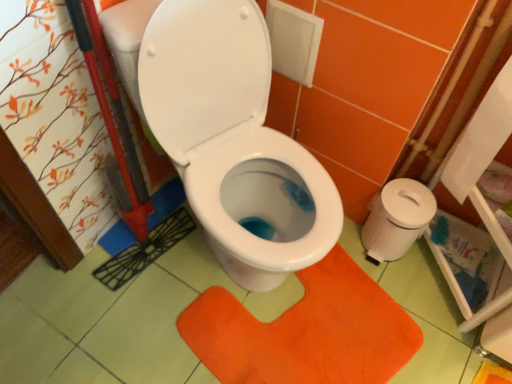
I want to click on white plastic toilet paper at right, positioned as the 1th toilet paper in back-to-front order, so click(397, 219).

Locate an element on the screen. The image size is (512, 384). orange textured mat at center is located at coordinates (306, 331).

Locate an element on the screen. Image resolution: width=512 pixels, height=384 pixels. white plastic toilet paper at right, positioned as the 1th toilet paper in back-to-front order is located at coordinates (397, 219).

Is white plastic toilet paper at right, which is the 2th toilet paper from front to back, far away from white paper at right, which is the second toilet paper from back to front?

No, white plastic toilet paper at right, which is the 2th toilet paper from front to back, is in close proximity to white paper at right, which is the second toilet paper from back to front.

Is white plastic toilet paper at right, which is the 2th toilet paper from front to back, taller or shorter than white paper at right, acting as the 1th toilet paper starting from the front?

Considering their sizes, white plastic toilet paper at right, which is the 2th toilet paper from front to back, has less height than white paper at right, acting as the 1th toilet paper starting from the front.

Considering the points (387, 190) and (510, 107), which point is in front, point (387, 190) or point (510, 107)?

The point (510, 107) is in front.

Between white plastic toilet paper at right, which is the 2th toilet paper from front to back, and white paper at right, acting as the 1th toilet paper starting from the front, which one has smaller size?

Smaller between the two is white paper at right, acting as the 1th toilet paper starting from the front.

Could you measure the distance between white paper at right, acting as the 1th toilet paper starting from the front, and white plastic toilet paper at right, which is the 2th toilet paper from front to back?

white paper at right, acting as the 1th toilet paper starting from the front, is 9.29 inches from white plastic toilet paper at right, which is the 2th toilet paper from front to back.

The image size is (512, 384). Identify the location of toilet paper directly beneath the white paper at right, which is the second toilet paper from back to front (from a real-world perspective). (397, 219).

From the image's perspective, does white paper at right, acting as the 1th toilet paper starting from the front, appear lower than white plastic toilet paper at right, which is the 2th toilet paper from front to back?

Actually, white paper at right, acting as the 1th toilet paper starting from the front, appears above white plastic toilet paper at right, which is the 2th toilet paper from front to back, in the image.

From a real-world perspective, is white paper at right, acting as the 1th toilet paper starting from the front, positioned under white plastic toilet paper at right, positioned as the 1th toilet paper in back-to-front order, based on gravity?

Actually, white paper at right, acting as the 1th toilet paper starting from the front, is physically above white plastic toilet paper at right, positioned as the 1th toilet paper in back-to-front order, in the real world.

Is orange textured mat at center not near white plastic toilet paper at right, which is the 2th toilet paper from front to back?

No, there isn't a large distance between orange textured mat at center and white plastic toilet paper at right, which is the 2th toilet paper from front to back.

Is orange textured mat at center positioned beyond the bounds of white plastic toilet paper at right, which is the 2th toilet paper from front to back?

orange textured mat at center lies outside white plastic toilet paper at right, which is the 2th toilet paper from front to back,'s area.

Consider the image. From a real-world perspective, which is physically above, orange textured mat at center or white plastic toilet paper at right, positioned as the 1th toilet paper in back-to-front order?

In real-world perspective, white plastic toilet paper at right, positioned as the 1th toilet paper in back-to-front order, is above.

Is the position of orange textured mat at center less distant than that of white plastic toilet paper at right, positioned as the 1th toilet paper in back-to-front order?

Yes, it is.

In terms of size, does white paper at right, acting as the 1th toilet paper starting from the front, appear bigger or smaller than orange textured mat at center?

white paper at right, acting as the 1th toilet paper starting from the front, is smaller than orange textured mat at center.

Does white paper at right, acting as the 1th toilet paper starting from the front, have a greater height compared to orange textured mat at center?

Yes.

Does white paper at right, acting as the 1th toilet paper starting from the front, touch orange textured mat at center?

white paper at right, acting as the 1th toilet paper starting from the front, is not next to orange textured mat at center, and they're not touching.

Is white paper at right, which is the second toilet paper from back to front, positioned beyond the bounds of orange textured mat at center?

Yes, white paper at right, which is the second toilet paper from back to front, is not within orange textured mat at center.

Would you say white paper at right, acting as the 1th toilet paper starting from the front, is part of orange textured mat at center's contents?

Actually, white paper at right, acting as the 1th toilet paper starting from the front, is outside orange textured mat at center.

Between point (214, 299) and point (492, 86), which one is positioned in front?

Point (492, 86)

Which of these two, orange textured mat at center or white paper at right, which is the second toilet paper from back to front, is thinner?

white paper at right, which is the second toilet paper from back to front.

From the image's perspective, who appears lower, orange textured mat at center or white paper at right, which is the second toilet paper from back to front?

orange textured mat at center, from the image's perspective.

Is white plastic toilet paper at right, which is the 2th toilet paper from front to back, spatially inside orange textured mat at center, or outside of it?

white plastic toilet paper at right, which is the 2th toilet paper from front to back, lies outside orange textured mat at center.

Which is in front, point (382, 191) or point (298, 277)?

The point (382, 191) is in front.

Is there a large distance between white plastic toilet paper at right, positioned as the 1th toilet paper in back-to-front order, and orange textured mat at center?

They are positioned close to each other.

From a real-world perspective, does white plastic toilet paper at right, positioned as the 1th toilet paper in back-to-front order, sit lower than orange textured mat at center?

Incorrect, from a real-world perspective, white plastic toilet paper at right, positioned as the 1th toilet paper in back-to-front order, is higher than orange textured mat at center.

Where is `toilet paper on the right of white plastic toilet paper at right, which is the 2th toilet paper from front to back`? This screenshot has width=512, height=384. toilet paper on the right of white plastic toilet paper at right, which is the 2th toilet paper from front to back is located at coordinates (480, 137).

In order to click on toilet paper that appears below the white paper at right, acting as the 1th toilet paper starting from the front (from a real-world perspective) in this screenshot , I will do `click(397, 219)`.

Which object lies nearer to the anchor point white plastic toilet paper at right, which is the 2th toilet paper from front to back, orange textured mat at center or white paper at right, which is the second toilet paper from back to front?

white paper at right, which is the second toilet paper from back to front, is closer to white plastic toilet paper at right, which is the 2th toilet paper from front to back.

Consider the image. Looking at the image, which one is located closer to white paper at right, acting as the 1th toilet paper starting from the front, orange textured mat at center or white plastic toilet paper at right, which is the 2th toilet paper from front to back?

white plastic toilet paper at right, which is the 2th toilet paper from front to back.

Estimate the real-world distances between objects in this image. Which object is further from white plastic toilet paper at right, positioned as the 1th toilet paper in back-to-front order, white paper at right, acting as the 1th toilet paper starting from the front, or orange textured mat at center?

orange textured mat at center.

Which object lies nearer to the anchor point orange textured mat at center, white paper at right, which is the second toilet paper from back to front, or white plastic toilet paper at right, which is the 2th toilet paper from front to back?

white plastic toilet paper at right, which is the 2th toilet paper from front to back, lies closer to orange textured mat at center than the other object.

Estimate the real-world distances between objects in this image. Which object is closer to orange textured mat at center, white plastic toilet paper at right, positioned as the 1th toilet paper in back-to-front order, or white paper at right, acting as the 1th toilet paper starting from the front?

white plastic toilet paper at right, positioned as the 1th toilet paper in back-to-front order, is closer to orange textured mat at center.

From the image, which object appears to be nearer to white paper at right, which is the second toilet paper from back to front, white plastic toilet paper at right, positioned as the 1th toilet paper in back-to-front order, or orange textured mat at center?

Among the two, white plastic toilet paper at right, positioned as the 1th toilet paper in back-to-front order, is located nearer to white paper at right, which is the second toilet paper from back to front.

The image size is (512, 384). I want to click on toilet paper between white paper at right, which is the second toilet paper from back to front, and orange textured mat at center, in the vertical direction, so click(397, 219).